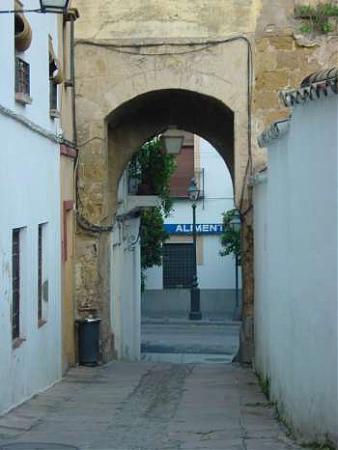
This screenshot has height=450, width=338. Find the location of `light`. light is located at coordinates (60, 5).